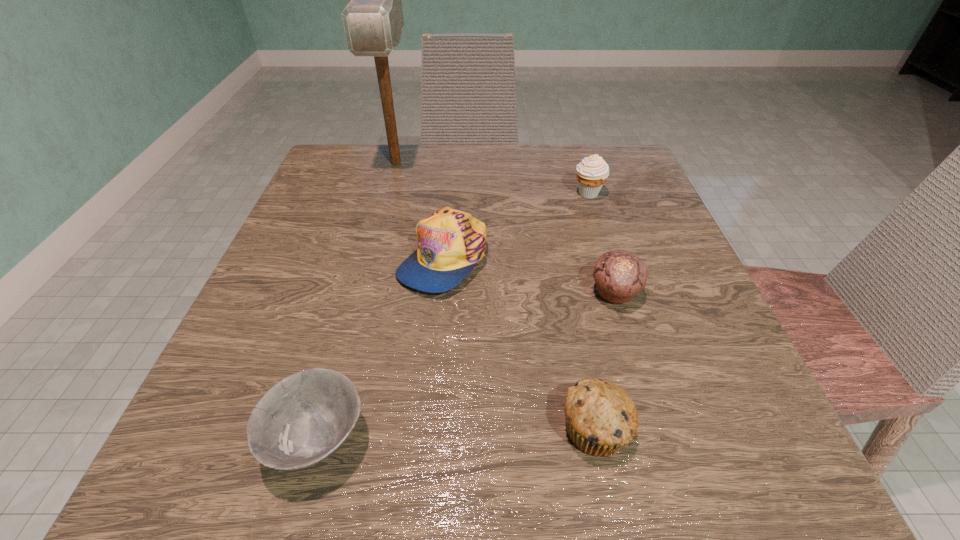
Where is `free space located 0.290m on the bill of the cap`? This screenshot has height=540, width=960. free space located 0.290m on the bill of the cap is located at coordinates (422, 483).

The image size is (960, 540). Find the location of `vacant region located 0.050m on the front of the second nearest muffin`. vacant region located 0.050m on the front of the second nearest muffin is located at coordinates (629, 338).

This screenshot has width=960, height=540. Find the location of `free location located on the left of the nearest muffin`. free location located on the left of the nearest muffin is located at coordinates (418, 429).

You are a GUI agent. You are given a task and a screenshot of the screen. Output one action in this format:
    pyautogui.click(x=<x>, y=<y>)
    Task: Click on the blank space located on the back of the bowl
    
    Given the screenshot: What is the action you would take?
    pyautogui.click(x=345, y=342)

Image resolution: width=960 pixels, height=540 pixels. Find the location of `mallet located in the far edge section of the desktop`. mallet located in the far edge section of the desktop is located at coordinates (373, 20).

Locate an element on the screen. This screenshot has width=960, height=540. muffin that is at the far edge is located at coordinates (592, 172).

This screenshot has height=540, width=960. I want to click on muffin located in the near edge section of the desktop, so click(x=601, y=418).

Identify the location of bowl situated at the near edge. The height and width of the screenshot is (540, 960). (303, 419).

Identify the location of mallet that is at the left edge. The width and height of the screenshot is (960, 540). (373, 20).

This screenshot has width=960, height=540. I want to click on bowl situated at the left edge, so click(303, 419).